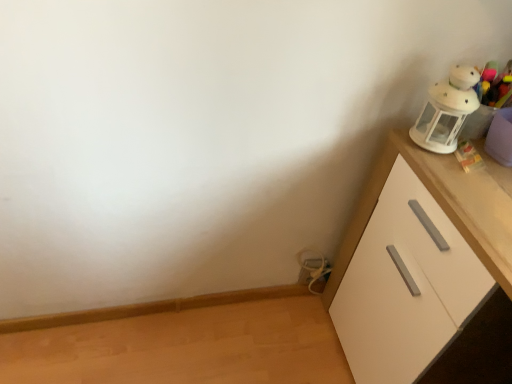
Describe the element at coordinates (406, 285) in the screenshot. The height and width of the screenshot is (384, 512). I see `white matte cabinet at right` at that location.

Where is `white plush toy at upper right, arranged as the first toy when viewed from the right`? This screenshot has width=512, height=384. white plush toy at upper right, arranged as the first toy when viewed from the right is located at coordinates (447, 110).

Where is `white matte cabinet at right`? white matte cabinet at right is located at coordinates (406, 285).

Based on the photo, from the image's perspective, is white matte cabinet at right located above metallic silver cable at lower center, placed as the second toy when sorted from top to bottom?

No, from the image's perspective, white matte cabinet at right is not over metallic silver cable at lower center, placed as the second toy when sorted from top to bottom.

Which object is further away from the camera taking this photo, white matte cabinet at right or metallic silver cable at lower center, which ranks as the 2th toy in front-to-back order?

Positioned behind is metallic silver cable at lower center, which ranks as the 2th toy in front-to-back order.

Is metallic silver cable at lower center, which ranks as the first toy in bottom-to-top order, a part of white matte cabinet at right?

Actually, metallic silver cable at lower center, which ranks as the first toy in bottom-to-top order, is outside white matte cabinet at right.

From a real-world perspective, which object stands above the other?

white matte cabinet at right is physically above.

From a real-world perspective, who is located higher, white matte cabinet at right or white plush toy at upper right, which is the second toy in bottom-to-top order?

white plush toy at upper right, which is the second toy in bottom-to-top order.

Which object is positioned more to the right, white matte cabinet at right or white plush toy at upper right, the second toy viewed from the back?

white matte cabinet at right.

From the picture: Is the depth of white matte cabinet at right greater than that of white plush toy at upper right, the first toy positioned from the top?

No, it is not.

Is white plush toy at upper right, the first toy positioned from the top, wider than white matte cabinet at right?

In fact, white plush toy at upper right, the first toy positioned from the top, might be narrower than white matte cabinet at right.

Looking at the image, does white plush toy at upper right, acting as the first toy starting from the front, seem bigger or smaller compared to white matte cabinet at right?

In the image, white plush toy at upper right, acting as the first toy starting from the front, appears to be smaller than white matte cabinet at right.

Which object is closer to the camera taking this photo, white plush toy at upper right, acting as the first toy starting from the front, or white matte cabinet at right?

white matte cabinet at right is in front.

Is white plush toy at upper right, the first toy positioned from the top, beside white matte cabinet at right?

No, white plush toy at upper right, the first toy positioned from the top, is not beside white matte cabinet at right.

Do you think white plush toy at upper right, which is the second toy in bottom-to-top order, is within metallic silver cable at lower center, which is the second toy in right-to-left order, or outside of it?

white plush toy at upper right, which is the second toy in bottom-to-top order, lies outside metallic silver cable at lower center, which is the second toy in right-to-left order.

Is white plush toy at upper right, the first toy positioned from the top, turned away from metallic silver cable at lower center, which ranks as the 2th toy in front-to-back order?

No, white plush toy at upper right, the first toy positioned from the top,'s orientation is not away from metallic silver cable at lower center, which ranks as the 2th toy in front-to-back order.

Are white plush toy at upper right, the first toy positioned from the top, and metallic silver cable at lower center, marked as the 1th toy in a back-to-front arrangement, beside each other?

No, white plush toy at upper right, the first toy positioned from the top, is not beside metallic silver cable at lower center, marked as the 1th toy in a back-to-front arrangement.

Is metallic silver cable at lower center, which ranks as the 2th toy in front-to-back order, surrounding white plush toy at upper right, which is counted as the second toy, starting from the left?

No, white plush toy at upper right, which is counted as the second toy, starting from the left, is not inside metallic silver cable at lower center, which ranks as the 2th toy in front-to-back order.

Between metallic silver cable at lower center, placed as the second toy when sorted from top to bottom, and white plush toy at upper right, which is counted as the second toy, starting from the left, which one has larger size?

Bigger between the two is white plush toy at upper right, which is counted as the second toy, starting from the left.

How different are the orientations of metallic silver cable at lower center, which ranks as the 2th toy in front-to-back order, and white plush toy at upper right, the second toy viewed from the back, in degrees?

88 degrees.

Which object is wider, metallic silver cable at lower center, which ranks as the first toy in bottom-to-top order, or white plush toy at upper right, acting as the first toy starting from the front?

Wider between the two is white plush toy at upper right, acting as the first toy starting from the front.

Is metallic silver cable at lower center, which is the second toy in right-to-left order, surrounding white matte cabinet at right?

Actually, white matte cabinet at right is outside metallic silver cable at lower center, which is the second toy in right-to-left order.

From the image's perspective, is metallic silver cable at lower center, marked as the 1th toy in a back-to-front arrangement, beneath white matte cabinet at right?

No.

Does metallic silver cable at lower center, which ranks as the 2th toy in front-to-back order, touch white matte cabinet at right?

metallic silver cable at lower center, which ranks as the 2th toy in front-to-back order, and white matte cabinet at right are not in contact.

Based on the photo, which is closer, (x=307, y=275) or (x=367, y=323)?

Point (x=307, y=275) is positioned farther from the camera compared to point (x=367, y=323).

Find the location of a particular element. The width and height of the screenshot is (512, 384). cabinetry that appears below the metallic silver cable at lower center, which ranks as the first toy in bottom-to-top order (from the image's perspective) is located at coordinates (406, 285).

I want to click on toy above the white matte cabinet at right (from a real-world perspective), so click(447, 110).

Estimate the real-world distances between objects in this image. Which object is further from white plush toy at upper right, which is the second toy in bottom-to-top order, white matte cabinet at right or metallic silver cable at lower center, which ranks as the first toy in bottom-to-top order?

Based on the image, metallic silver cable at lower center, which ranks as the first toy in bottom-to-top order, appears to be further to white plush toy at upper right, which is the second toy in bottom-to-top order.

Considering their positions, is metallic silver cable at lower center, which ranks as the 2th toy in front-to-back order, positioned closer to white matte cabinet at right than white plush toy at upper right, the second toy viewed from the back?

white plush toy at upper right, the second toy viewed from the back, is closer to white matte cabinet at right.

Estimate the real-world distances between objects in this image. Which object is further from metallic silver cable at lower center, placed as the second toy when sorted from top to bottom, white plush toy at upper right, arranged as the first toy when viewed from the right, or white matte cabinet at right?

white plush toy at upper right, arranged as the first toy when viewed from the right, lies further to metallic silver cable at lower center, placed as the second toy when sorted from top to bottom, than the other object.

Based on their spatial positions, is white plush toy at upper right, which is counted as the second toy, starting from the left, or metallic silver cable at lower center, placed as the second toy when sorted from top to bottom, closer to white matte cabinet at right?

The object closer to white matte cabinet at right is white plush toy at upper right, which is counted as the second toy, starting from the left.

When comparing their distances from white plush toy at upper right, which is the second toy in bottom-to-top order, does metallic silver cable at lower center, acting as the 1th toy starting from the left, or white matte cabinet at right seem closer?

white matte cabinet at right is closer to white plush toy at upper right, which is the second toy in bottom-to-top order.

Estimate the real-world distances between objects in this image. Which object is closer to metallic silver cable at lower center, which ranks as the first toy in bottom-to-top order, white matte cabinet at right or white plush toy at upper right, the first toy positioned from the top?

The object closer to metallic silver cable at lower center, which ranks as the first toy in bottom-to-top order, is white matte cabinet at right.

Where is `toy positioned between white matte cabinet at right and metallic silver cable at lower center, which ranks as the first toy in bottom-to-top order, from near to far`? This screenshot has width=512, height=384. toy positioned between white matte cabinet at right and metallic silver cable at lower center, which ranks as the first toy in bottom-to-top order, from near to far is located at coordinates (447, 110).